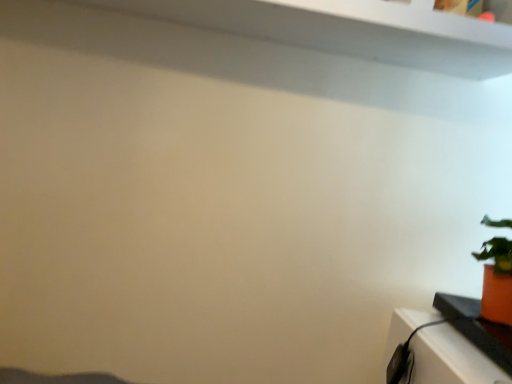
Question: Should I look upward or downward to see orange matte pot at right?

Choices:
 (A) up
 (B) down

Answer: (B)

Question: Is orange matte pot at right completely or partially inside orange matte pot at right?

Choices:
 (A) no
 (B) yes

Answer: (A)

Question: Can you confirm if orange matte pot at right is taller than orange matte pot at right?

Choices:
 (A) yes
 (B) no

Answer: (A)

Question: Are orange matte pot at right and orange matte pot at right located far from each other?

Choices:
 (A) yes
 (B) no

Answer: (B)

Question: Is orange matte pot at right outside of orange matte pot at right?

Choices:
 (A) no
 (B) yes

Answer: (B)

Question: Is orange matte pot at right smaller than orange matte pot at right?

Choices:
 (A) yes
 (B) no

Answer: (B)

Question: From the image's perspective, is orange matte pot at right below orange matte pot at right?

Choices:
 (A) yes
 (B) no

Answer: (B)

Question: Does orange matte pot at right touch orange matte pot at right?

Choices:
 (A) no
 (B) yes

Answer: (A)

Question: From the image's perspective, is orange matte pot at right located beneath orange matte pot at right?

Choices:
 (A) yes
 (B) no

Answer: (A)

Question: From a real-world perspective, is orange matte pot at right physically below orange matte pot at right?

Choices:
 (A) yes
 (B) no

Answer: (A)

Question: Can orange matte pot at right be found inside orange matte pot at right?

Choices:
 (A) no
 (B) yes

Answer: (A)

Question: From the image's perspective, does orange matte pot at right appear higher than orange matte pot at right?

Choices:
 (A) yes
 (B) no

Answer: (B)

Question: Considering the relative sizes of orange matte pot at right and orange matte pot at right in the image provided, is orange matte pot at right thinner than orange matte pot at right?

Choices:
 (A) no
 (B) yes

Answer: (A)

Question: Considering the relative positions of orange matte pot at right and orange matte pot at right in the image provided, is orange matte pot at right to the left or to the right of orange matte pot at right?

Choices:
 (A) right
 (B) left

Answer: (A)